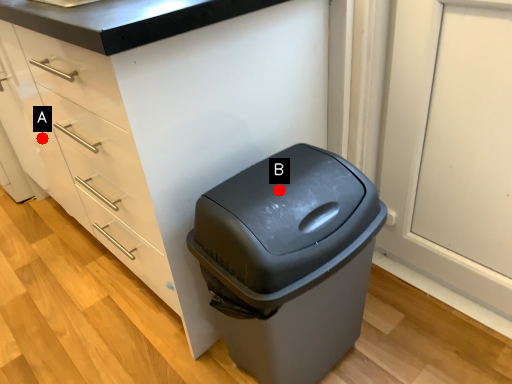
Question: Two points are circled on the image, labeled by A and B beside each circle. Which of the following is the closest to the observer?

Choices:
 (A) A is closer
 (B) B is closer

Answer: (B)